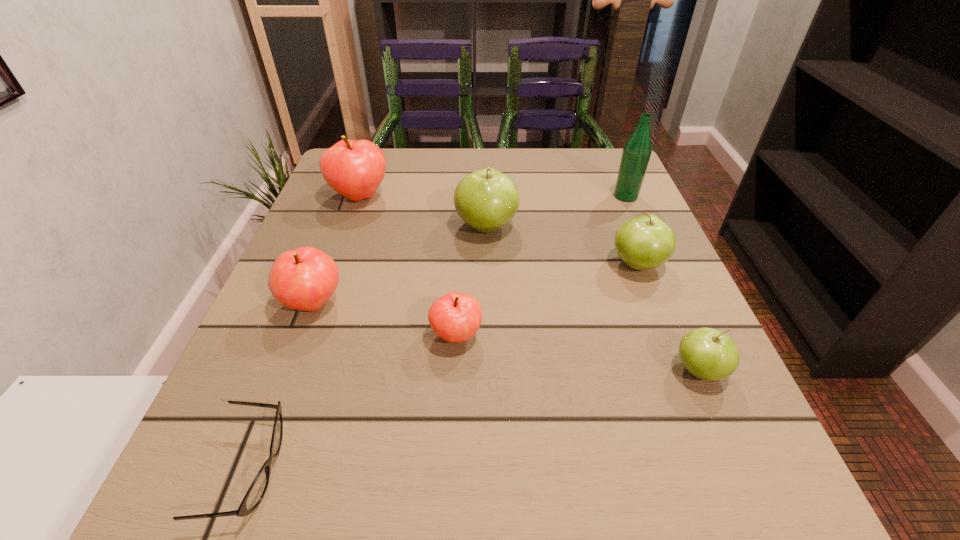
This screenshot has width=960, height=540. I want to click on green bottle, so click(637, 151).

Identify the location of the tallest object. The image size is (960, 540). (637, 151).

At what (x,y) coordinates should I click in order to perform the action: click on the leftmost green apple. Please return your answer as a coordinate pair (x, y). Image resolution: width=960 pixels, height=540 pixels. Looking at the image, I should click on (487, 199).

Identify the location of the farthest green apple. (487, 199).

The image size is (960, 540). I want to click on the farthest red apple, so click(x=355, y=169).

Where is `the second biggest red apple`? the second biggest red apple is located at coordinates (304, 279).

The width and height of the screenshot is (960, 540). Find the location of `the second farthest green apple`. the second farthest green apple is located at coordinates [645, 242].

The height and width of the screenshot is (540, 960). In order to click on the smallest red apple in this screenshot , I will do `click(455, 317)`.

This screenshot has width=960, height=540. Find the location of `the nearest green apple`. the nearest green apple is located at coordinates (709, 354).

Find the location of `the shortest object`. the shortest object is located at coordinates (253, 497).